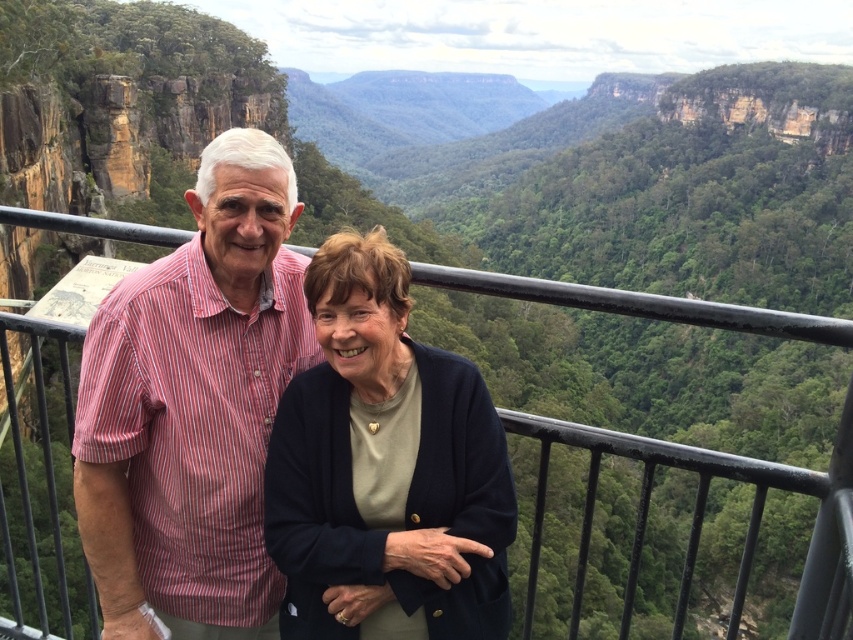
Question: Does dark blue sweater at center have a larger size compared to black metal railing at upper center?

Choices:
 (A) no
 (B) yes

Answer: (A)

Question: Can you confirm if striped cotton shirt at left is wider than dark blue sweater at center?

Choices:
 (A) no
 (B) yes

Answer: (A)

Question: Which object is the farthest from the striped cotton shirt at left?

Choices:
 (A) dark blue sweater at center
 (B) black metal railing at upper center

Answer: (B)

Question: Can you confirm if striped cotton shirt at left is positioned above dark blue sweater at center?

Choices:
 (A) no
 (B) yes

Answer: (B)

Question: Which is farther from the black metal railing at upper center?

Choices:
 (A) striped cotton shirt at left
 (B) dark blue sweater at center

Answer: (B)

Question: Which object appears farthest from the camera in this image?

Choices:
 (A) dark blue sweater at center
 (B) black metal railing at upper center

Answer: (A)